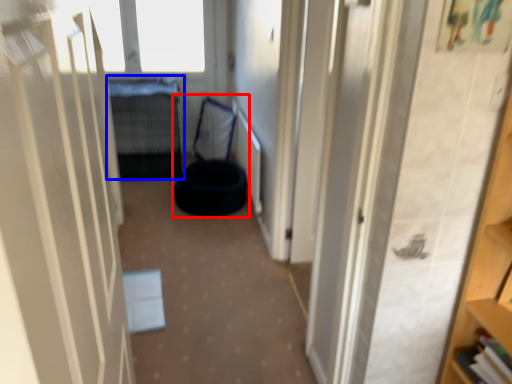
Question: Among these objects, which one is nearest to the camera, bean bag chair (highlighted by a red box) or bed (highlighted by a blue box)?

Choices:
 (A) bean bag chair
 (B) bed

Answer: (B)